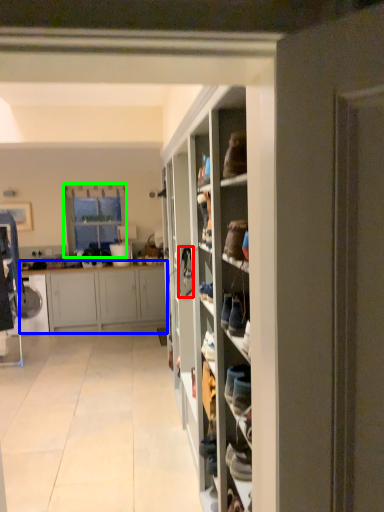
Question: Estimate the real-world distances between objects in this image. Which object is closer to shoe (highlighted by a red box), cabinetry (highlighted by a blue box) or window (highlighted by a green box)?

Choices:
 (A) cabinetry
 (B) window

Answer: (A)